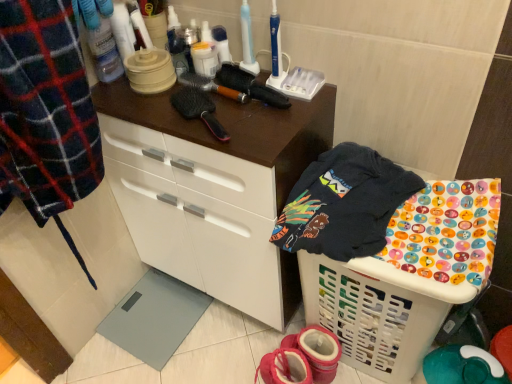
Question: Considering the positions of pink fabric booties at lower center and black synthetic hairbrush at upper center in the image, is pink fabric booties at lower center bigger or smaller than black synthetic hairbrush at upper center?

Choices:
 (A) big
 (B) small

Answer: (A)

Question: From the image's perspective, relative to black synthetic hairbrush at upper center, is pink fabric booties at lower center above or below?

Choices:
 (A) below
 (B) above

Answer: (A)

Question: Based on their relative distances, which object is farther from the pink fabric booties at lower center?

Choices:
 (A) white plastic laundry basket at lower right
 (B) matte white cabinet at center
 (C) dark blue cotton t-shirt at upper right
 (D) black synthetic hairbrush at upper center

Answer: (D)

Question: Which of these objects is positioned farthest from the dark blue cotton t-shirt at upper right?

Choices:
 (A) black synthetic hairbrush at upper center
 (B) matte white cabinet at center
 (C) pink fabric booties at lower center
 (D) white plastic laundry basket at lower right

Answer: (C)